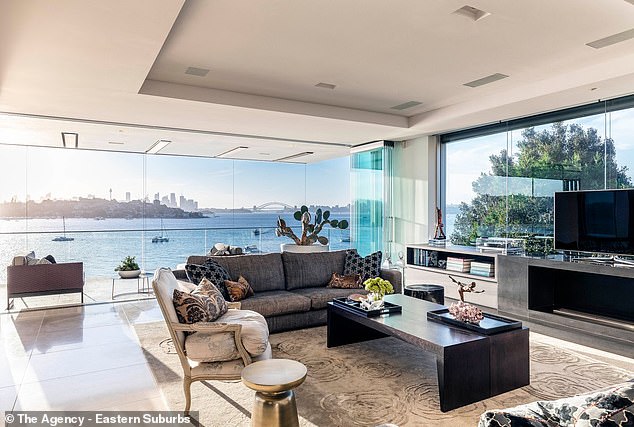
Locate an element on the screen. tan arm chair is located at coordinates (247, 325).